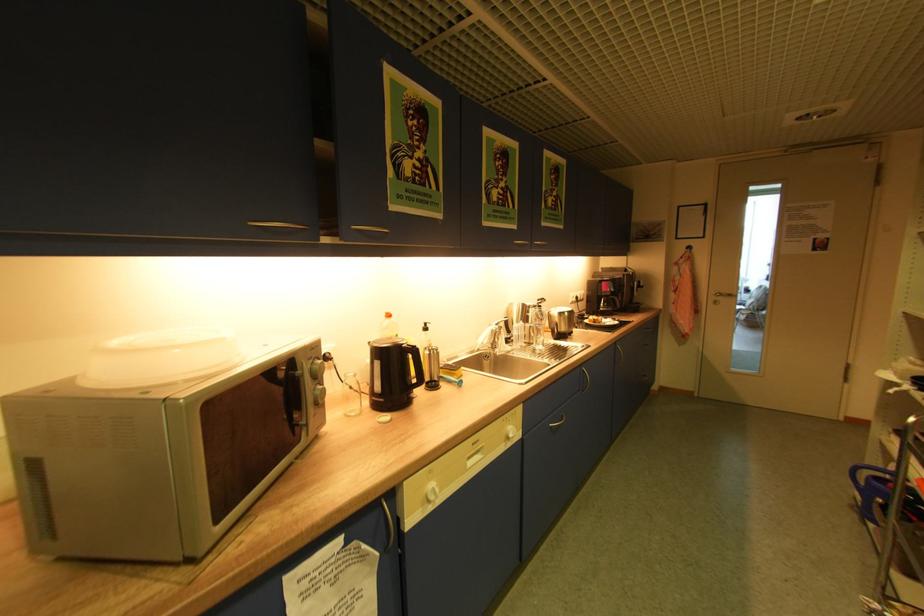
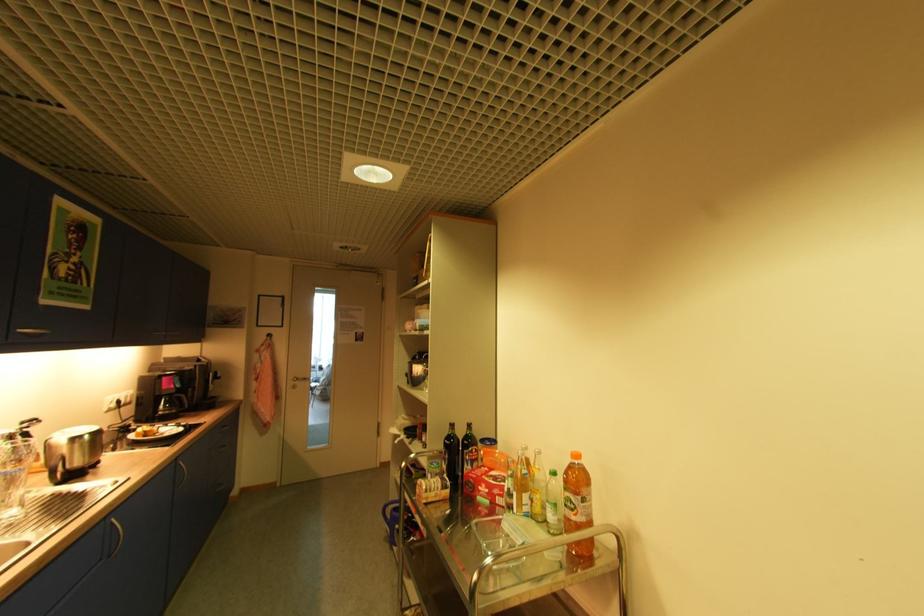
Where in the second image is the point corresponding to the point at 614,294 from the first image?

(178, 392)